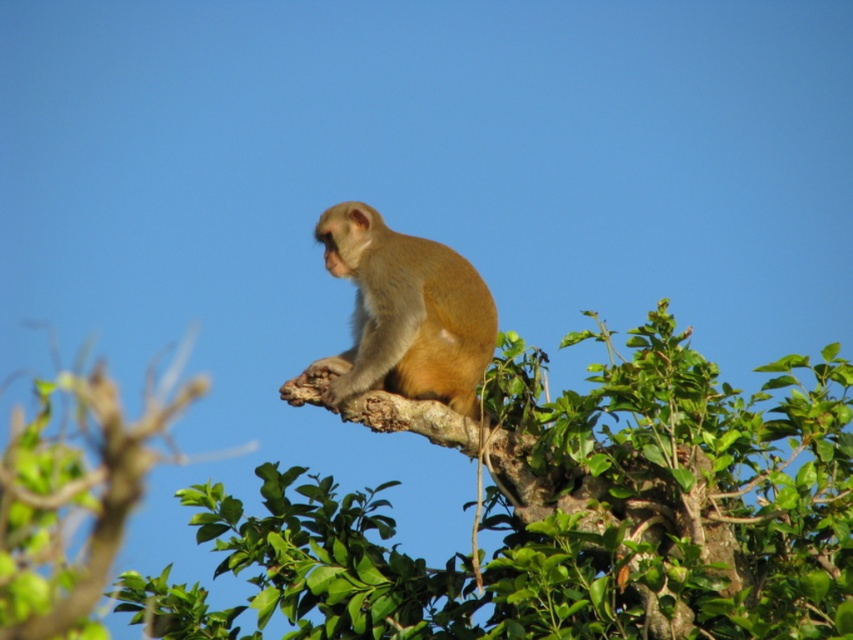
Can you confirm if green leafy tree at upper center is smaller than golden fur monkey at upper center?

Incorrect, green leafy tree at upper center is not smaller in size than golden fur monkey at upper center.

Who is more forward, (576,340) or (431,307)?

Point (576,340)

Identify the location of green leafy tree at upper center. (570, 516).